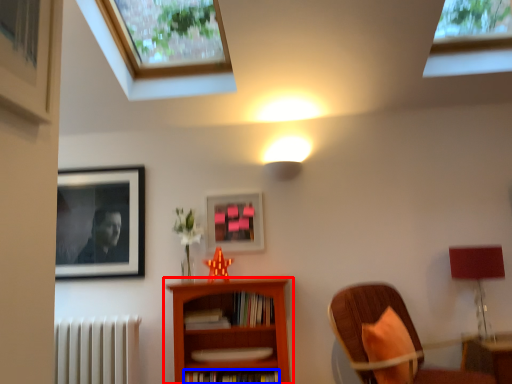
Question: Which of the following is the closest to the observer, bookcase (highlighted by a red box) or book (highlighted by a blue box)?

Choices:
 (A) bookcase
 (B) book

Answer: (A)